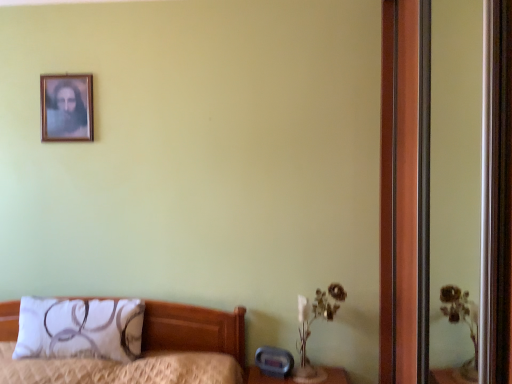
Question: Should I look upward or downward to see white fabric pillow at lower left?

Choices:
 (A) up
 (B) down

Answer: (B)

Question: Is white fabric pillow at lower left located outside wooden picture frame at upper left?

Choices:
 (A) yes
 (B) no

Answer: (A)

Question: Does white fabric pillow at lower left have a smaller size compared to wooden picture frame at upper left?

Choices:
 (A) yes
 (B) no

Answer: (B)

Question: Is wooden picture frame at upper left inside white fabric pillow at lower left?

Choices:
 (A) yes
 (B) no

Answer: (B)

Question: Considering the relative positions of white fabric pillow at lower left and wooden picture frame at upper left in the image provided, is white fabric pillow at lower left behind wooden picture frame at upper left?

Choices:
 (A) yes
 (B) no

Answer: (B)

Question: Is white fabric pillow at lower left placed right next to wooden picture frame at upper left?

Choices:
 (A) yes
 (B) no

Answer: (B)

Question: Is white fabric pillow at lower left thinner than wooden picture frame at upper left?

Choices:
 (A) yes
 (B) no

Answer: (B)

Question: Is wooden picture frame at upper left at the right side of white fabric pillow at lower left?

Choices:
 (A) yes
 (B) no

Answer: (B)

Question: Considering the relative positions of wooden picture frame at upper left and white fabric pillow at lower left in the image provided, is wooden picture frame at upper left in front of white fabric pillow at lower left?

Choices:
 (A) no
 (B) yes

Answer: (A)

Question: Is wooden picture frame at upper left turned away from white fabric pillow at lower left?

Choices:
 (A) no
 (B) yes

Answer: (A)

Question: Is white fabric pillow at lower left inside wooden picture frame at upper left?

Choices:
 (A) yes
 (B) no

Answer: (B)

Question: Is wooden picture frame at upper left wider than white fabric pillow at lower left?

Choices:
 (A) no
 (B) yes

Answer: (A)

Question: Is wooden picture frame at upper left aimed at white fabric pillow at lower left?

Choices:
 (A) no
 (B) yes

Answer: (A)

Question: Can we say wooden screen door at right lies outside wooden picture frame at upper left?

Choices:
 (A) no
 (B) yes

Answer: (B)